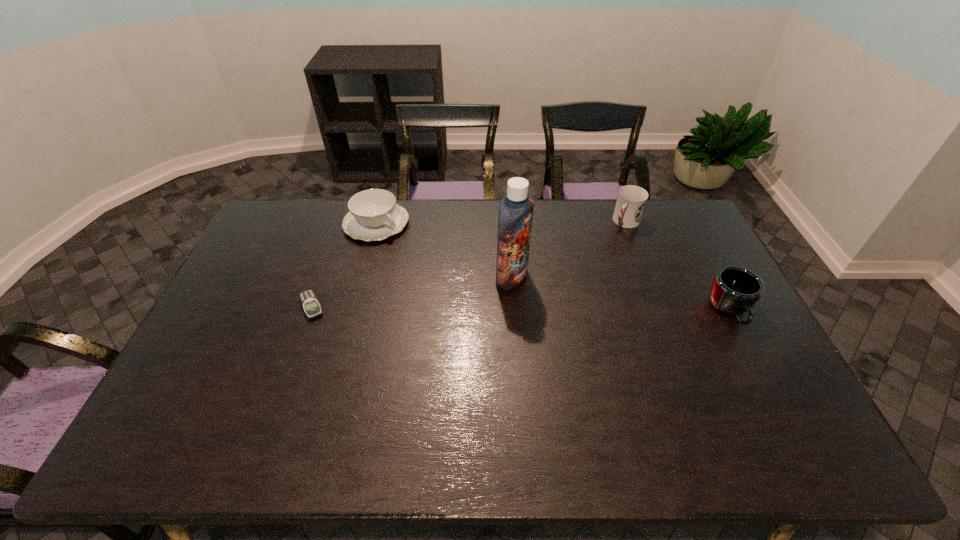
At what (x,y) coordinates should I click in order to perform the action: click on free space on the desktop that is between the shortest object and the rightmost object and is positioned on the handle side of the chinaware. Please return your answer as a coordinate pair (x, y). The width and height of the screenshot is (960, 540). Looking at the image, I should click on (487, 308).

At what (x,y) coordinates should I click in order to perform the action: click on free space on the desktop that is between the shortest object and the mug and is positioned on the front label of the shampoo. Please return your answer as a coordinate pair (x, y). Looking at the image, I should click on (579, 309).

Locate an element on the screen. Image resolution: width=960 pixels, height=540 pixels. vacant spot on the desktop that is between the shortest object and the rightmost object and is positioned on the handle side of the cup is located at coordinates (556, 309).